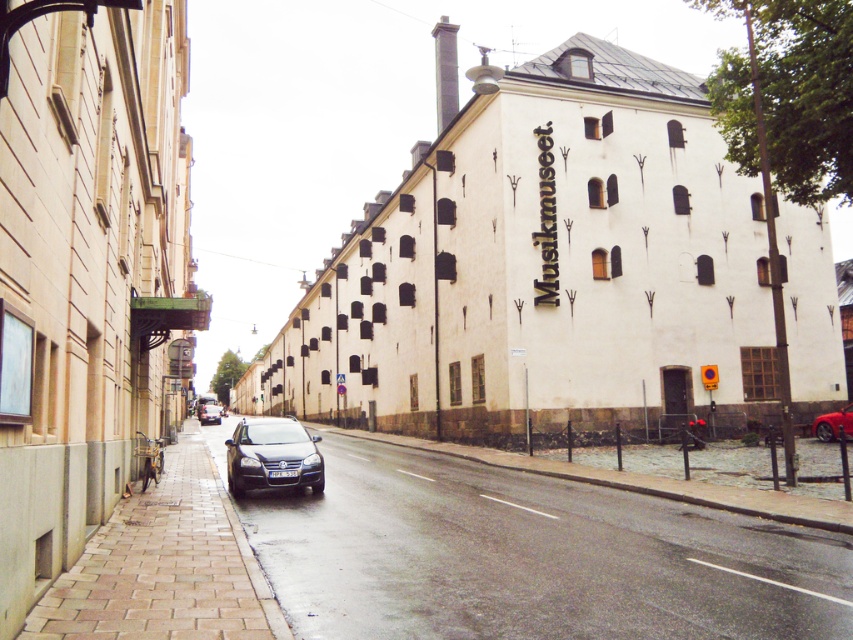
Question: Is brown brick pavement at lower left thinner than shiny black car at center?

Choices:
 (A) yes
 (B) no

Answer: (B)

Question: Does paved stone sidewalk at center have a greater width compared to shiny black sedan at center?

Choices:
 (A) no
 (B) yes

Answer: (B)

Question: Is paved stone sidewalk at center above brown brick pavement at lower left?

Choices:
 (A) yes
 (B) no

Answer: (A)

Question: Which point is farther to the camera?

Choices:
 (A) shiny black sedan at center
 (B) shiny red car at right
 (C) shiny black car at center
 (D) brown brick pavement at lower left

Answer: (A)

Question: Considering the real-world distances, which object is farthest from the paved stone sidewalk at center?

Choices:
 (A) brown brick pavement at lower left
 (B) shiny black car at center
 (C) shiny black sedan at center

Answer: (C)

Question: Which object is farther from the camera taking this photo?

Choices:
 (A) shiny red car at right
 (B) paved stone sidewalk at center
 (C) shiny black sedan at center
 (D) brown brick pavement at lower left

Answer: (C)